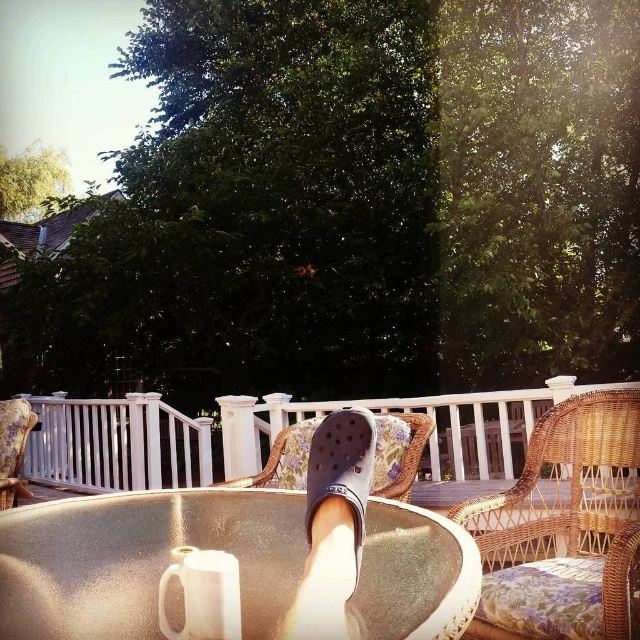
Question: Can you confirm if clear acrylic jacuzzi at center is positioned to the left of woven rattan armchair at center?

Choices:
 (A) no
 (B) yes

Answer: (B)

Question: Estimate the real-world distances between objects in this image. Which object is closer to the woven rattan armchair at center?

Choices:
 (A) clear acrylic jacuzzi at center
 (B) woven rattan chair at center

Answer: (B)

Question: Among these objects, which one is farthest from the camera?

Choices:
 (A) clear acrylic jacuzzi at center
 (B) gray rubber sandal at center
 (C) woven rattan chair at center

Answer: (C)

Question: Observing the image, what is the correct spatial positioning of woven rattan armchair at center in reference to woven wicker chair at center?

Choices:
 (A) left
 (B) right

Answer: (B)

Question: Is clear acrylic jacuzzi at center closer to the viewer compared to woven rattan chair at center?

Choices:
 (A) no
 (B) yes

Answer: (B)

Question: Which is farther from the wooden wicker chair at lower left?

Choices:
 (A) woven rattan chair at center
 (B) clear acrylic jacuzzi at center

Answer: (B)